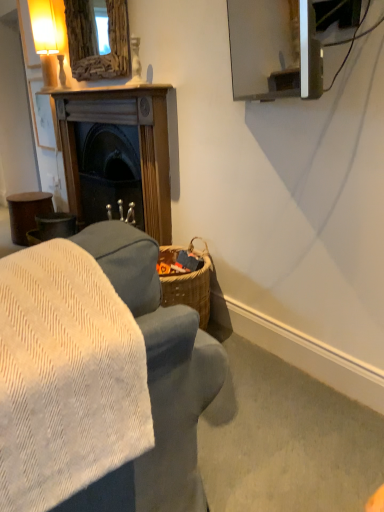
Image resolution: width=384 pixels, height=512 pixels. Describe the element at coordinates (156, 383) in the screenshot. I see `velvet gray couch at lower left` at that location.

In order to click on velvet gray couch at lower left in this screenshot , I will do `click(156, 383)`.

Could you tell me if wooden mirror at upper center is turned towards wooden fireplace at left?

No, wooden mirror at upper center is not turned towards wooden fireplace at left.

Which object is closer to the camera, wooden mirror at upper center or wooden fireplace at left?

wooden fireplace at left is in front.

Who is shorter, wooden mirror at upper center or wooden fireplace at left?

Standing shorter between the two is wooden mirror at upper center.

Can you confirm if wooden fireplace at left is taller than matte glass table lamp at upper left?

Yes, wooden fireplace at left is taller than matte glass table lamp at upper left.

Considering the relative positions of wooden fireplace at left and matte glass table lamp at upper left in the image provided, is wooden fireplace at left in front of matte glass table lamp at upper left?

Yes, it is.

Does wooden fireplace at left turn towards matte glass table lamp at upper left?

No, wooden fireplace at left is not oriented towards matte glass table lamp at upper left.

Considering the relative sizes of velvet gray couch at lower left and wooden mirror at upper center in the image provided, is velvet gray couch at lower left taller than wooden mirror at upper center?

In fact, velvet gray couch at lower left may be shorter than wooden mirror at upper center.

From the image's perspective, does velvet gray couch at lower left appear higher than wooden mirror at upper center?

No, from the image's perspective, velvet gray couch at lower left is not over wooden mirror at upper center.

Looking at this image, is velvet gray couch at lower left not inside wooden mirror at upper center?

Yes, velvet gray couch at lower left is located beyond the bounds of wooden mirror at upper center.

Is velvet gray couch at lower left taller or shorter than wooden fireplace at left?

Considering their sizes, velvet gray couch at lower left has less height than wooden fireplace at left.

Is velvet gray couch at lower left positioned far away from wooden fireplace at left?

Yes.

From a real-world perspective, between velvet gray couch at lower left and wooden fireplace at left, who is vertically lower?

velvet gray couch at lower left is physically lower.

Which is behind, point (145, 323) or point (136, 123)?

The point (136, 123) is farther from the camera.

Between wooden fireplace at left and wooden mirror at upper center, which one has larger width?

wooden fireplace at left.

Consider the image. Are wooden fireplace at left and wooden mirror at upper center located far from each other?

Actually, wooden fireplace at left and wooden mirror at upper center are a little close together.

Is wooden fireplace at left shorter than wooden mirror at upper center?

Incorrect, the height of wooden fireplace at left does not fall short of that of wooden mirror at upper center.

From a real-world perspective, is wooden fireplace at left over wooden mirror at upper center?

Actually, wooden fireplace at left is physically below wooden mirror at upper center in the real world.

Is matte glass table lamp at upper left not within velvet gray couch at lower left?

Absolutely, matte glass table lamp at upper left is external to velvet gray couch at lower left.

From the image's perspective, does matte glass table lamp at upper left appear higher than velvet gray couch at lower left?

Yes.

In the scene shown: From a real-world perspective, is matte glass table lamp at upper left on top of velvet gray couch at lower left?

Yes, from a real-world perspective, matte glass table lamp at upper left is on top of velvet gray couch at lower left.

Is matte glass table lamp at upper left in contact with velvet gray couch at lower left?

They are not placed beside each other.

Consider the image. Between matte glass table lamp at upper left and wooden fireplace at left, which one has more height?

wooden fireplace at left is taller.

Are matte glass table lamp at upper left and wooden fireplace at left making contact?

matte glass table lamp at upper left is not next to wooden fireplace at left, and they're not touching.

Does matte glass table lamp at upper left have a lesser width compared to wooden fireplace at left?

Yes, matte glass table lamp at upper left is thinner than wooden fireplace at left.

Could you tell me if matte glass table lamp at upper left is turned towards wooden fireplace at left?

No, matte glass table lamp at upper left is not oriented towards wooden fireplace at left.

Locate an element on the screen. mirror above the wooden fireplace at left (from the image's perspective) is located at coordinates (97, 40).

This screenshot has height=512, width=384. I want to click on fireplace located below the matte glass table lamp at upper left (from the image's perspective), so click(139, 143).

Which object lies further to the anchor point wooden fireplace at left, velvet gray couch at lower left or wooden mirror at upper center?

Based on the image, velvet gray couch at lower left appears to be further to wooden fireplace at left.

Considering their positions, is wooden fireplace at left positioned closer to matte glass table lamp at upper left than wooden mirror at upper center?

wooden mirror at upper center is positioned closer to the anchor matte glass table lamp at upper left.

Considering their positions, is matte glass table lamp at upper left positioned closer to wooden mirror at upper center than wooden fireplace at left?

wooden fireplace at left is positioned closer to the anchor wooden mirror at upper center.

Based on their spatial positions, is wooden mirror at upper center or matte glass table lamp at upper left further from velvet gray couch at lower left?

matte glass table lamp at upper left lies further to velvet gray couch at lower left than the other object.

Looking at the image, which one is located further to matte glass table lamp at upper left, wooden mirror at upper center or velvet gray couch at lower left?

velvet gray couch at lower left lies further to matte glass table lamp at upper left than the other object.

Based on their spatial positions, is wooden mirror at upper center or matte glass table lamp at upper left further from wooden fireplace at left?

matte glass table lamp at upper left is positioned further to the anchor wooden fireplace at left.

Considering their positions, is wooden mirror at upper center positioned further to matte glass table lamp at upper left than wooden fireplace at left?

wooden fireplace at left lies further to matte glass table lamp at upper left than the other object.

Estimate the real-world distances between objects in this image. Which object is closer to wooden mirror at upper center, wooden fireplace at left or matte glass table lamp at upper left?

wooden fireplace at left is closer to wooden mirror at upper center.

The image size is (384, 512). Identify the location of mirror between velvet gray couch at lower left and matte glass table lamp at upper left in the front-back direction. (97, 40).

Identify the location of fireplace between velvet gray couch at lower left and matte glass table lamp at upper left along the z-axis. (139, 143).

This screenshot has height=512, width=384. Identify the location of fireplace between velvet gray couch at lower left and wooden mirror at upper center along the z-axis. (139, 143).

Identify the location of mirror between matte glass table lamp at upper left and wooden fireplace at left in the up-down direction. (97, 40).